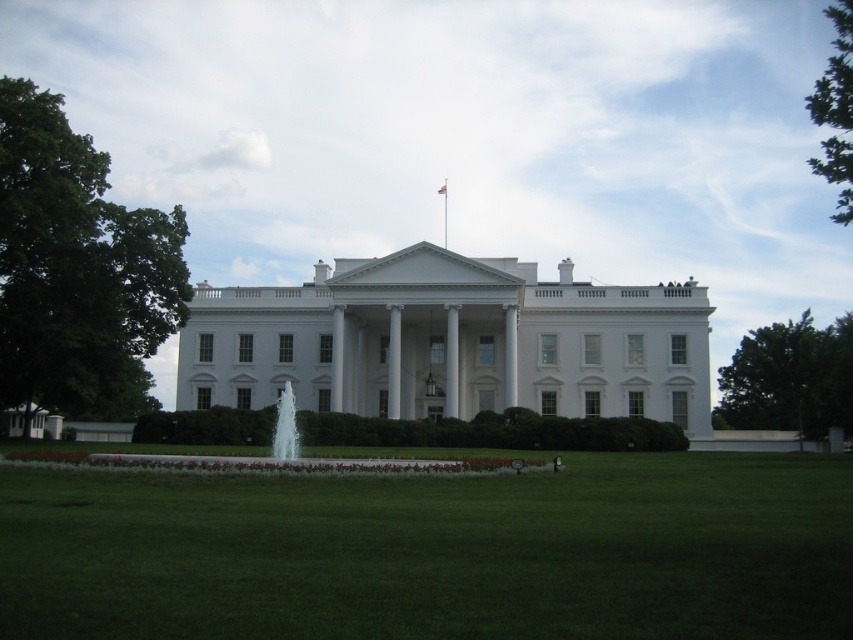
Who is more forward, (10, 364) or (289, 397)?

Point (289, 397) is more forward.

Can you confirm if green leafy tree at left is positioned to the left of clear glass water at center?

Correct, you'll find green leafy tree at left to the left of clear glass water at center.

I want to click on green leafy tree at left, so click(x=77, y=268).

Can you confirm if green leafy tree at right is taller than white smooth pillar at center?

Yes, green leafy tree at right is taller than white smooth pillar at center.

Who is more distant from viewer, (x=729, y=387) or (x=335, y=381)?

The point (x=729, y=387) is more distant.

Which is behind, point (819, 364) or point (338, 410)?

Point (819, 364)

I want to click on green leafy tree at right, so click(788, 378).

Does white smooth column at center have a smaller size compared to white glossy pillar at center?

Incorrect, white smooth column at center is not smaller in size than white glossy pillar at center.

Is point (393, 419) positioned in front of point (515, 362)?

Yes, point (393, 419) is closer to viewer.

The height and width of the screenshot is (640, 853). Identify the location of white smooth column at center. (393, 362).

Locate an element on the screen. The width and height of the screenshot is (853, 640). white smooth column at center is located at coordinates (393, 362).